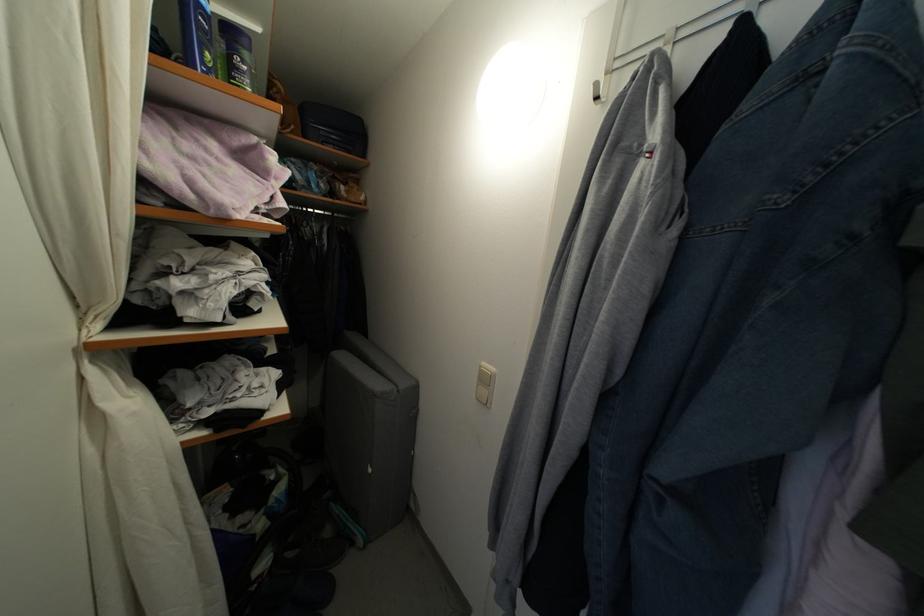
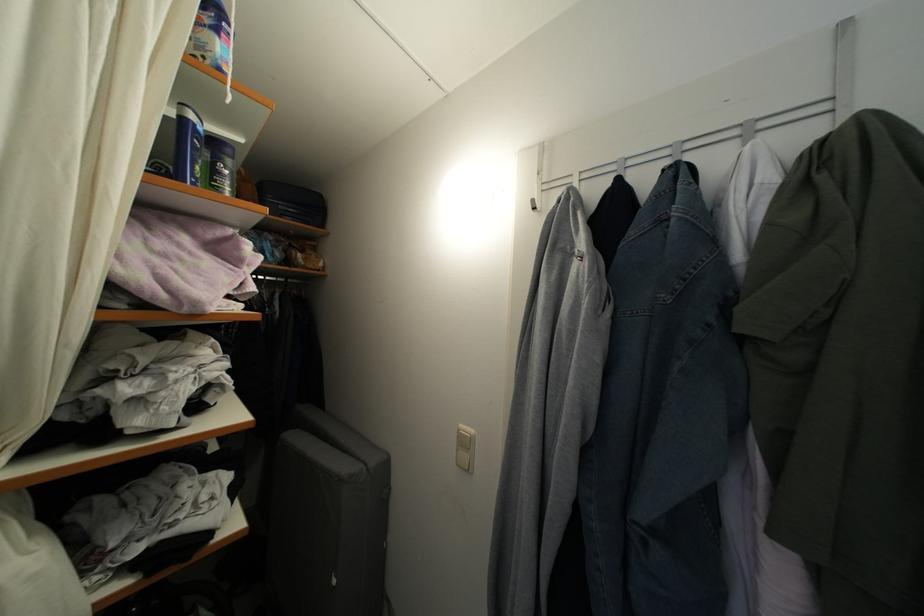
Where in the second image is the point corresponding to [251,61] from the first image?

(235, 168)